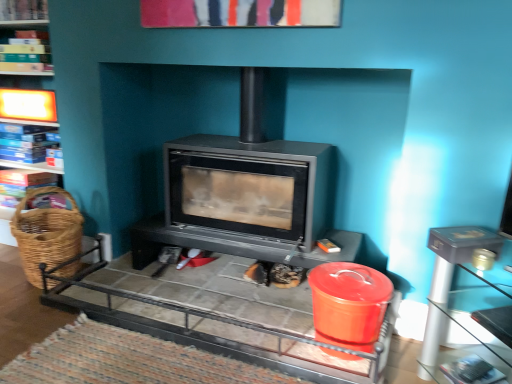
Question: From a real-world perspective, is metallic gray table at right, arranged as the second table when viewed from the left, physically located above or below blue cardboard boxes at left, which is the third shelf from top to bottom?

Choices:
 (A) below
 (B) above

Answer: (A)

Question: Is point (451, 276) closer or farther from the camera than point (25, 135)?

Choices:
 (A) farther
 (B) closer

Answer: (B)

Question: Which is farther from the wooden bookshelf at upper left, which is the second shelf in bottom-to-top order?

Choices:
 (A) blue cardboard boxes at left, which is counted as the 1th shelf, starting from the bottom
 (B) matte black fireplace at center, marked as the 1th table in a left-to-right arrangement
 (C) woven brown basket at left
 (D) wooden bookshelf at upper left, the 1th shelf positioned from the top
 (E) metallic gray table at right, acting as the 1th table starting from the right

Answer: (E)

Question: Which of these objects is positioned farthest from the metallic gray table at right, acting as the 1th table starting from the right?

Choices:
 (A) wooden bookshelf at upper left, which ranks as the 2th shelf in top-to-bottom order
 (B) wooden bookshelf at upper left, which is the third shelf in bottom-to-top order
 (C) matte black fireplace at center, placed as the 2th table when sorted from right to left
 (D) blue cardboard boxes at left, which is counted as the 1th shelf, starting from the bottom
 (E) woven brown basket at left

Answer: (B)